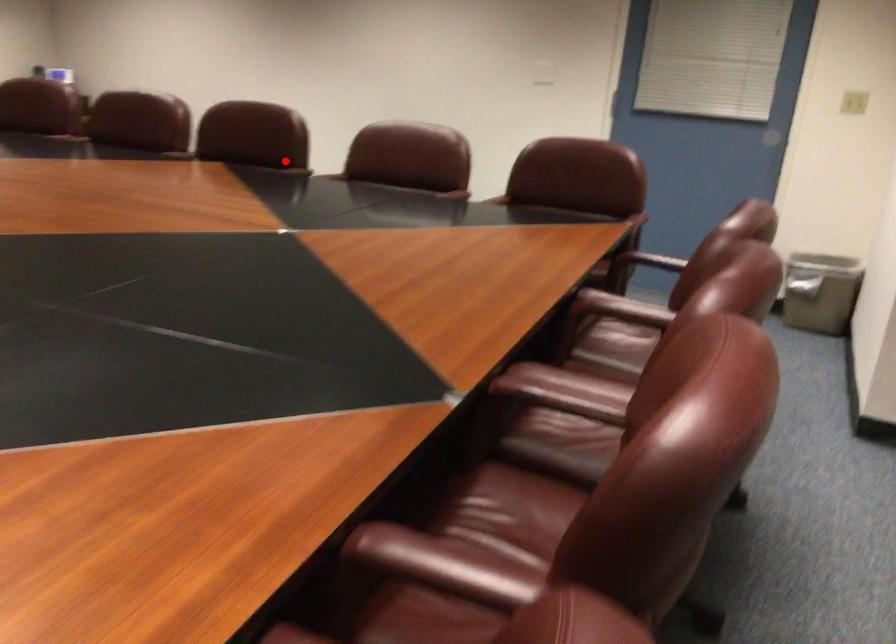
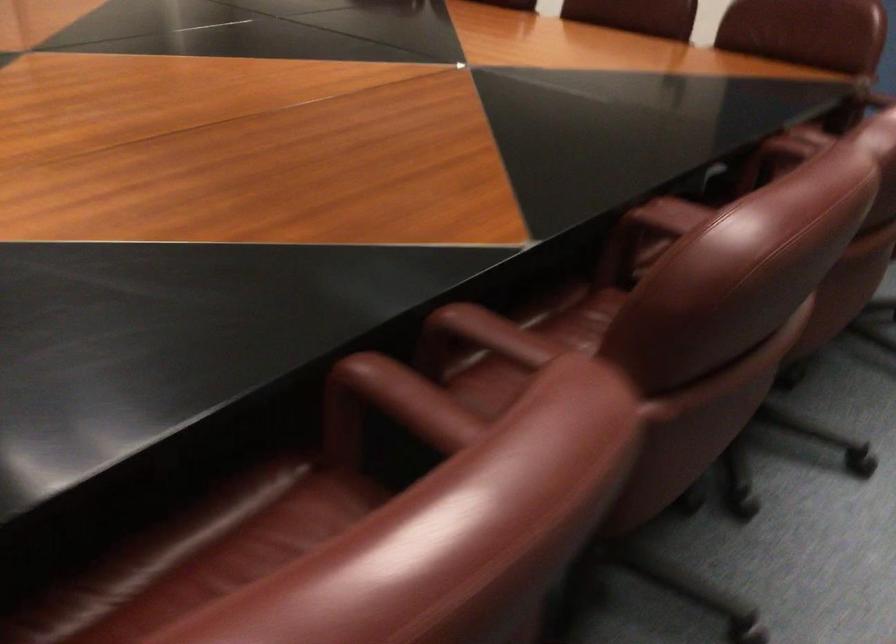
Question: A red point is marked in image1. In image2, is the corresponding 3D point closer to the camera or farther? Reply with the corresponding letter.

Choices:
 (A) The corresponding 3D point is closer.
 (B) The corresponding 3D point is farther.

Answer: (A)